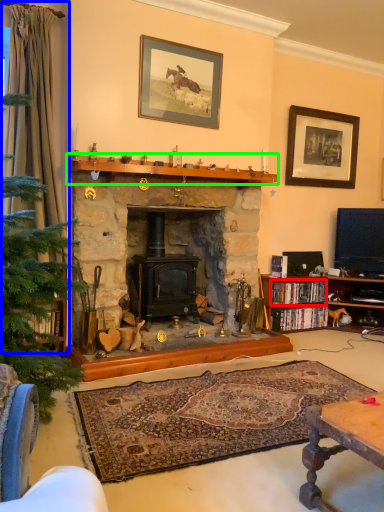
Question: Which object is the closest to the book (highlighted by a red box)? Choose among these: curtain (highlighted by a blue box) or mantle (highlighted by a green box).

Choices:
 (A) curtain
 (B) mantle

Answer: (B)